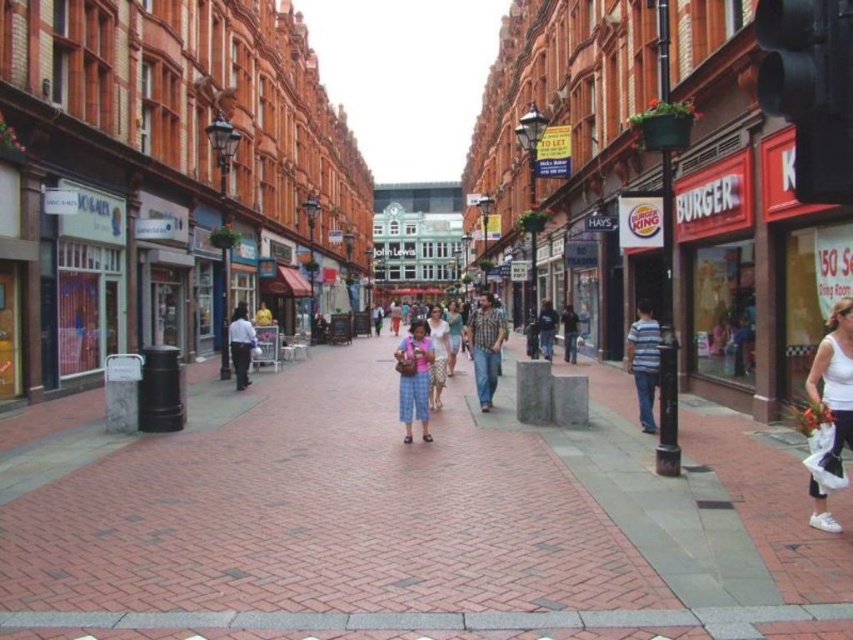
Can you confirm if light blue jeans at center is positioned to the left of matte pink dress at center?

Yes, light blue jeans at center is to the left of matte pink dress at center.

Between light blue jeans at center and matte pink dress at center, which one has less height?

With less height is matte pink dress at center.

Is point (244, 312) positioned behind point (428, 316)?

No, (244, 312) is closer to viewer.

Where is `light blue jeans at center`? Image resolution: width=853 pixels, height=640 pixels. light blue jeans at center is located at coordinates (241, 344).

From the picture: Does matte pink dress at center have a lesser height compared to denim shorts at center?

No.

Is matte pink dress at center to the left of denim shorts at center from the viewer's perspective?

Yes, matte pink dress at center is to the left of denim shorts at center.

This screenshot has width=853, height=640. What do you see at coordinates (438, 355) in the screenshot?
I see `matte pink dress at center` at bounding box center [438, 355].

Identify the location of matte pink dress at center. The width and height of the screenshot is (853, 640). (438, 355).

Who is lower down, brick pavement at center or dark blue jeans at center?

brick pavement at center is below.

Does point (216, 577) come closer to viewer compared to point (538, 323)?

Yes, it is in front of point (538, 323).

This screenshot has width=853, height=640. In order to click on brick pavement at center in this screenshot , I will do click(x=408, y=518).